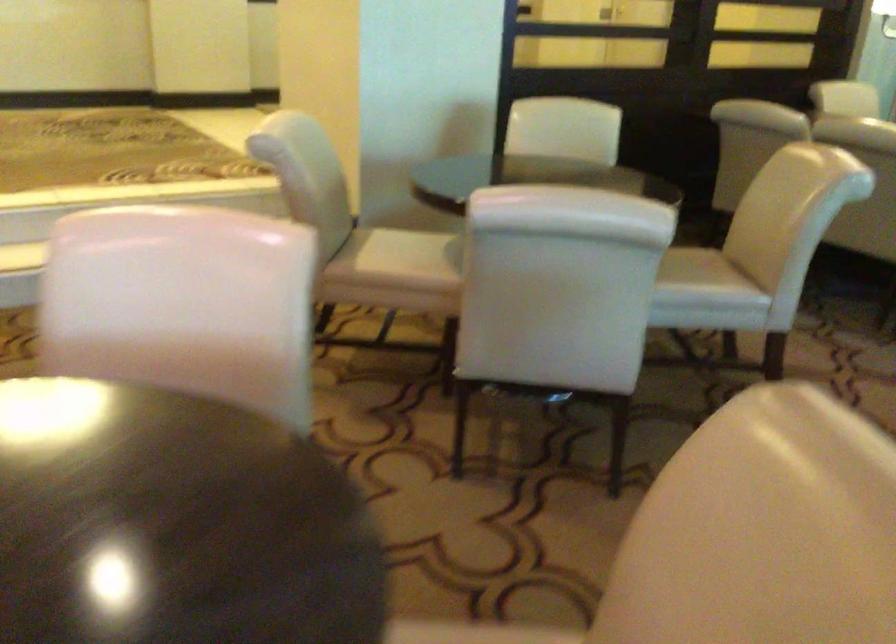
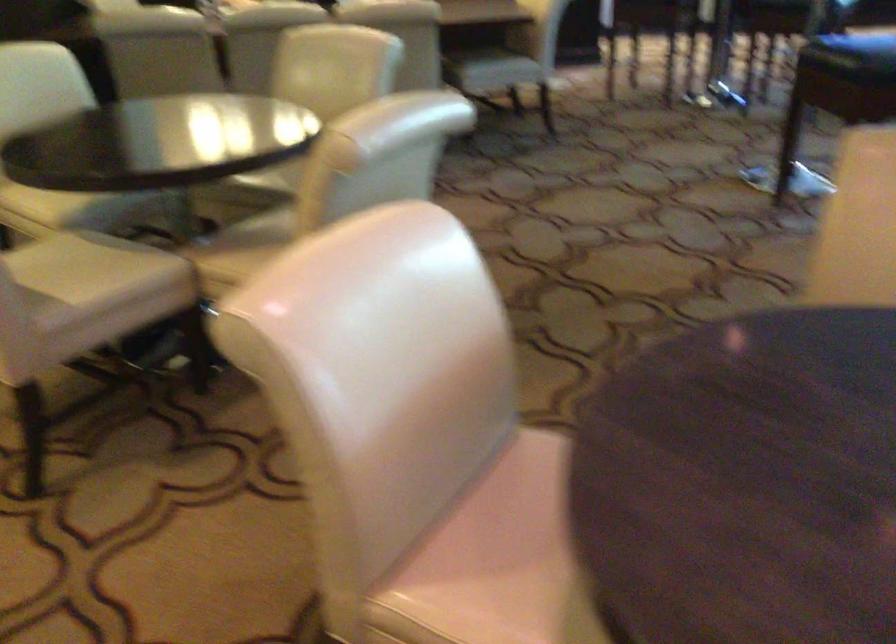
Where in the second image is the point corresponding to (420,254) from the first image?

(82, 266)